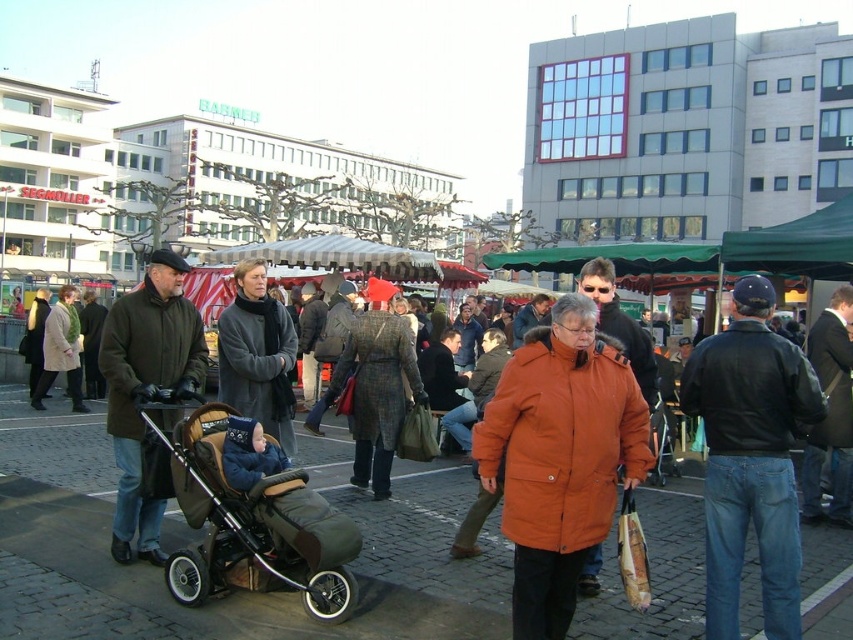
You are a tailor who needs to determine which coat requires more fabric to make. Based on the image, which coat between the dark gray wool coat at center and the light beige wool coat at center would need more fabric?

The light beige wool coat at center requires more fabric because its width is greater than the dark gray wool coat at center.